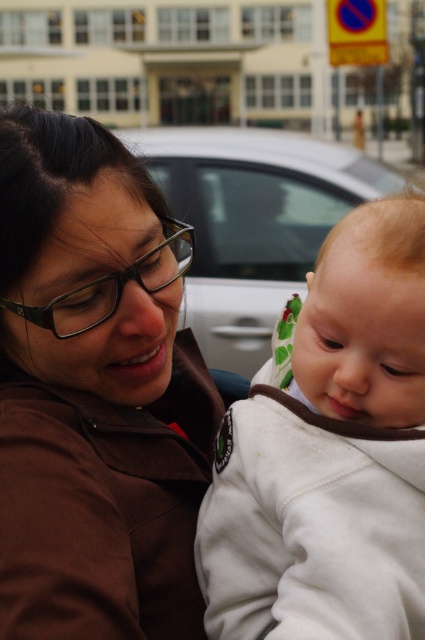
Question: Does brown fabric at center have a larger size compared to white soft baby at center?

Choices:
 (A) yes
 (B) no

Answer: (A)

Question: Which point is farther to the camera?

Choices:
 (A) (180, 332)
 (B) (288, 164)
 (C) (237, 588)

Answer: (B)

Question: Which object is positioned closest to the brown fabric at center?

Choices:
 (A) white glossy car at center
 (B) white soft baby at center

Answer: (B)

Question: Observing the image, what is the correct spatial positioning of white soft baby at center in reference to white glossy car at center?

Choices:
 (A) right
 (B) left

Answer: (A)

Question: Among these objects, which one is nearest to the camera?

Choices:
 (A) white glossy car at center
 (B) brown fabric at center
 (C) white soft baby at center

Answer: (B)

Question: Does white soft baby at center appear on the right side of white glossy car at center?

Choices:
 (A) yes
 (B) no

Answer: (A)